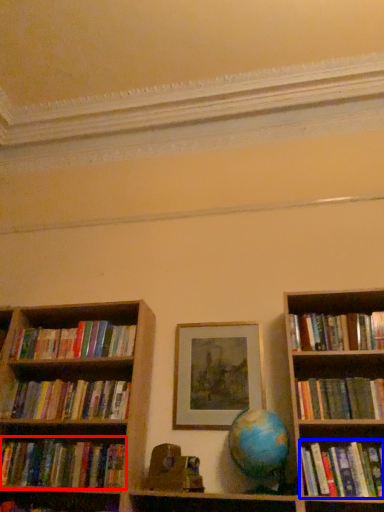
Question: Which point is further to the camera, book (highlighted by a red box) or book (highlighted by a blue box)?

Choices:
 (A) book
 (B) book

Answer: (A)